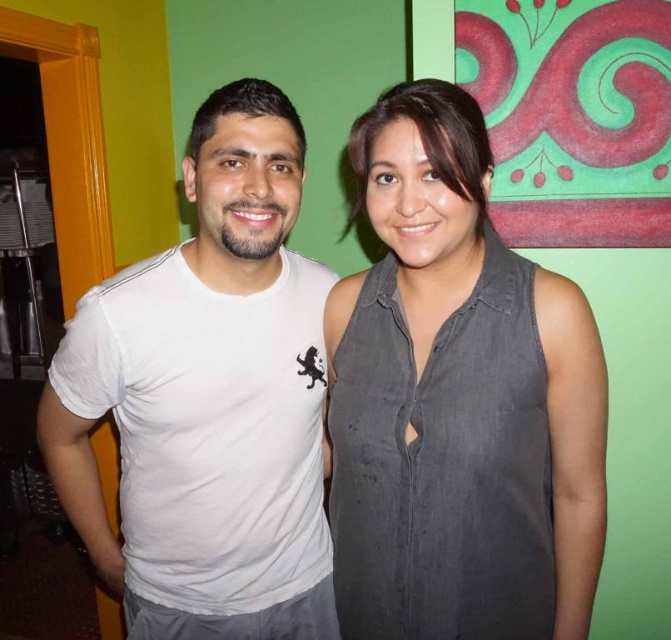
Is gray cotton shirt at center shorter than white cotton t-shirt at left?

Yes.

Is point (480, 612) behind point (185, 557)?

No, it is in front of (185, 557).

Is point (480, 321) less distant than point (223, 556)?

Yes, it is in front of point (223, 556).

Image resolution: width=671 pixels, height=640 pixels. Identify the location of gray cotton shirt at center. (458, 401).